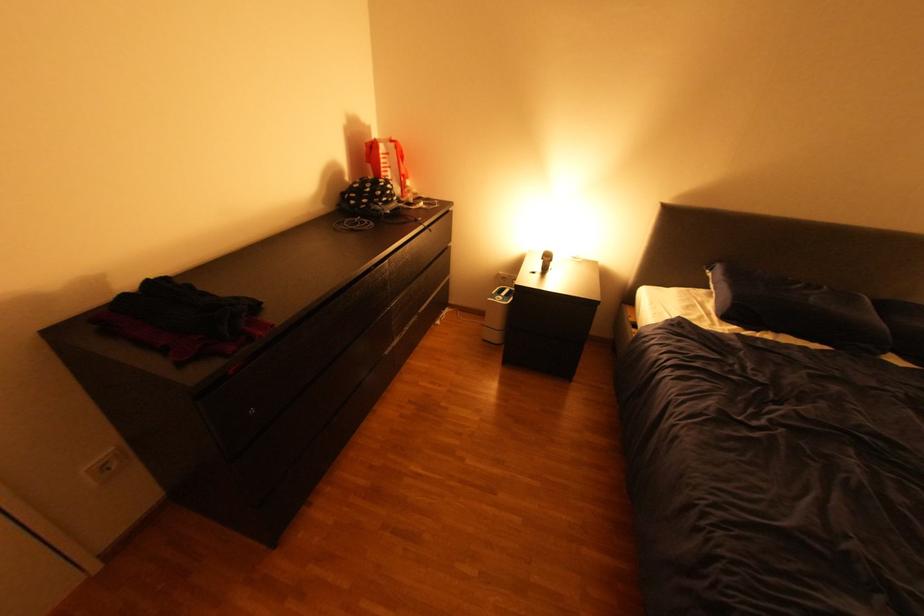
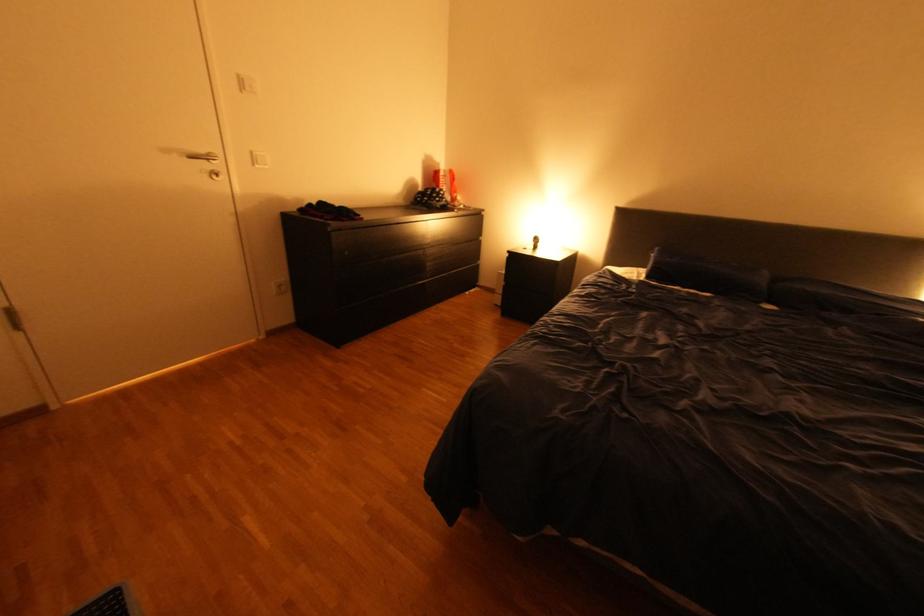
Locate, in the second image, the point that corresponds to point (402, 192) in the first image.

(454, 196)